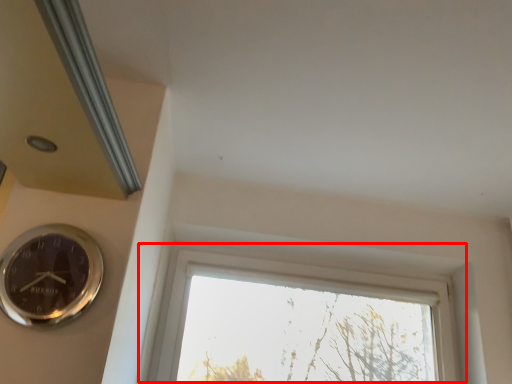
Question: From the image's perspective, what is the correct spatial relationship of window (annotated by the red box) in relation to wall clock?

Choices:
 (A) below
 (B) above

Answer: (A)